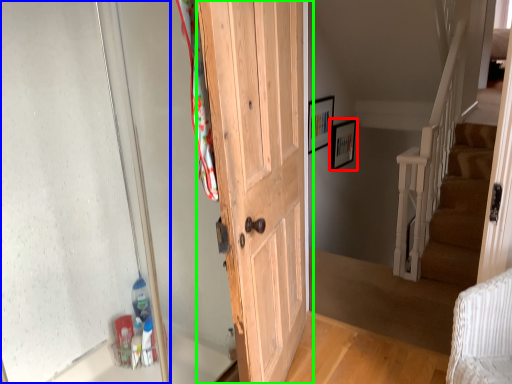
Question: Which object is the farthest from picture frame (highlighted by a red box)? Choose among these: glass door (highlighted by a blue box) or door (highlighted by a green box).

Choices:
 (A) glass door
 (B) door

Answer: (A)